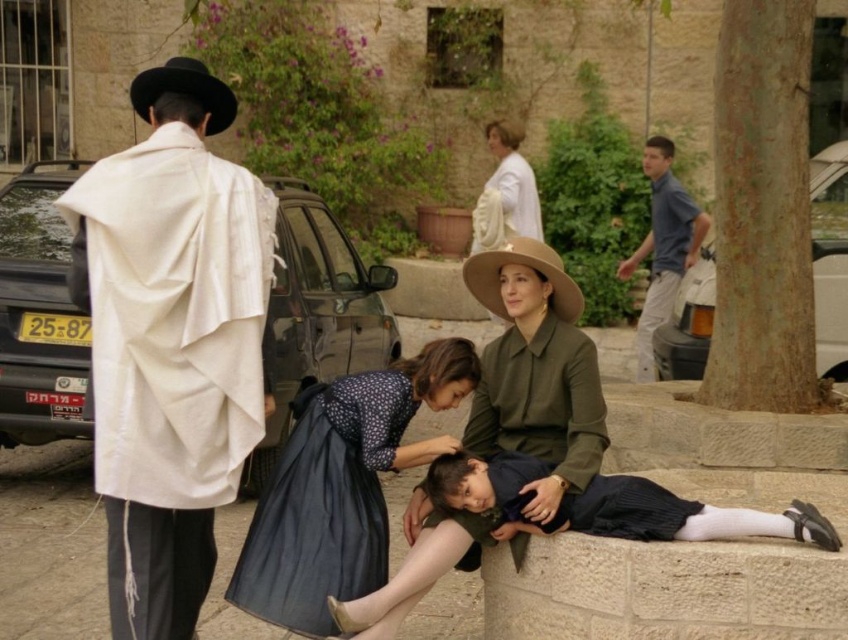
You are a photographer standing in the scene and want to take a photo of both the black glossy car at left and the dark blue satin dress at lower center. Which object should you focus on first to ensure it appears sharp in the photo?

The black glossy car at left should be focused on first because it is closer to the photographer than the dark blue satin dress at lower center, ensuring it stays sharp in the photo.

You are a photographer setting up a tripod at coordinates 0.8, 0.4. You need to place a prop at the location of the dark blue satin dress at lower center. Will the prop interfere with your tripod setup?

The dark blue satin dress at lower center is located at point (324, 506), which is very close to your tripod at (338, 512). The prop might interfere with the tripod setup due to their proximity.